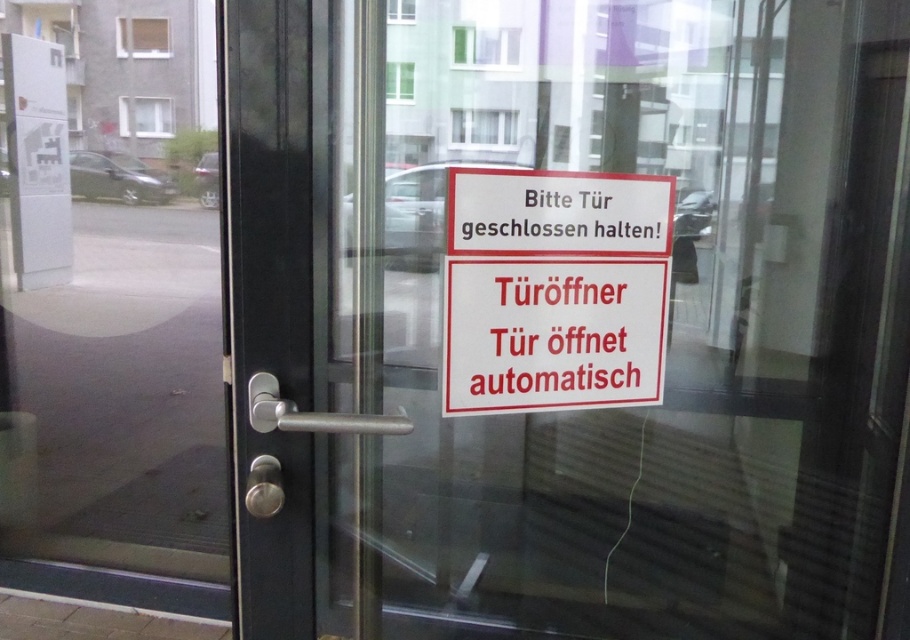
Question: Which object is farther from the camera taking this photo?

Choices:
 (A) red plastic sign at center
 (B) transparent glass door at center

Answer: (A)

Question: Does red plastic sign at center have a smaller size compared to white plastic parking sign at upper left?

Choices:
 (A) yes
 (B) no

Answer: (A)

Question: Can you confirm if red plastic sign at center is positioned to the right of white plastic parking sign at upper left?

Choices:
 (A) no
 (B) yes

Answer: (B)

Question: Can you confirm if red plastic sign at center is thinner than white plastic parking sign at upper left?

Choices:
 (A) yes
 (B) no

Answer: (B)

Question: Which point is closer to the camera?

Choices:
 (A) red plastic sign at center
 (B) white plastic parking sign at upper left
 (C) transparent glass door at center

Answer: (C)

Question: Which of these objects is positioned closest to the white plastic parking sign at upper left?

Choices:
 (A) transparent glass door at center
 (B) red plastic sign at center

Answer: (A)